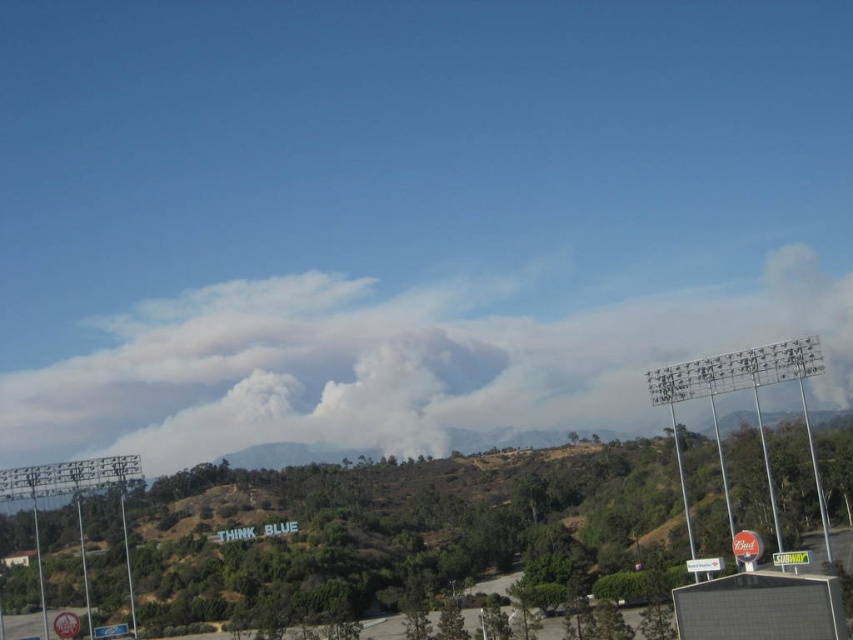
Can you confirm if white smoke cloud at center is smaller than green grassy hillside at center?

No, white smoke cloud at center is not smaller than green grassy hillside at center.

Is white smoke cloud at center taller than green grassy hillside at center?

Yes.

What do you see at coordinates (390, 365) in the screenshot? I see `white smoke cloud at center` at bounding box center [390, 365].

Where is `white smoke cloud at center`? white smoke cloud at center is located at coordinates (390, 365).